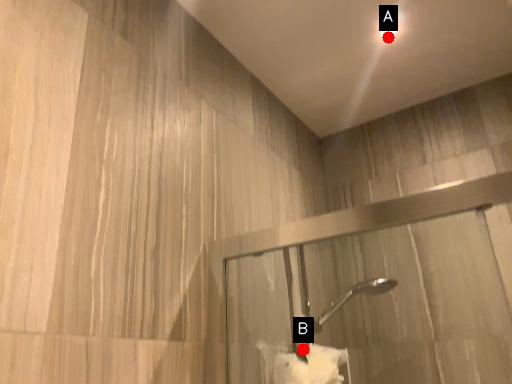
Question: Two points are circled on the image, labeled by A and B beside each circle. Which point is closer to the camera?

Choices:
 (A) A is closer
 (B) B is closer

Answer: (B)